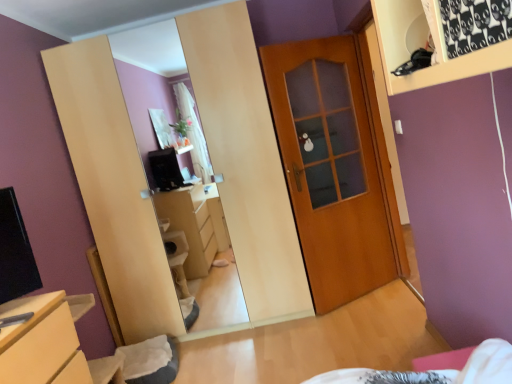
Question: Is black fabric at upper right bigger or smaller than matte wood chest of drawers at lower left?

Choices:
 (A) small
 (B) big

Answer: (A)

Question: Considering the relative positions of black fabric at upper right and matte wood chest of drawers at lower left in the image provided, is black fabric at upper right to the left or to the right of matte wood chest of drawers at lower left?

Choices:
 (A) left
 (B) right

Answer: (B)

Question: Which is nearer to the matte wood chest of drawers at lower left?

Choices:
 (A) black fabric at upper right
 (B) wooden door at center

Answer: (A)

Question: Which object is the farthest from the black fabric at upper right?

Choices:
 (A) wooden door at center
 (B) matte wood chest of drawers at lower left

Answer: (A)